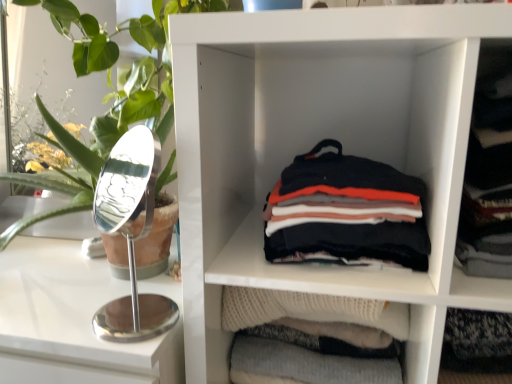
Question: Can you see green leafy plant at left touching soft cotton shirts at center?

Choices:
 (A) no
 (B) yes

Answer: (A)

Question: Is green leafy plant at left not within soft cotton shirts at center?

Choices:
 (A) no
 (B) yes

Answer: (B)

Question: Can you confirm if green leafy plant at left is shorter than soft cotton shirts at center?

Choices:
 (A) no
 (B) yes

Answer: (A)

Question: From a real-world perspective, is green leafy plant at left beneath soft cotton shirts at center?

Choices:
 (A) no
 (B) yes

Answer: (A)

Question: Considering the relative sizes of green leafy plant at left and soft cotton shirts at center in the image provided, is green leafy plant at left wider than soft cotton shirts at center?

Choices:
 (A) no
 (B) yes

Answer: (B)

Question: From a real-world perspective, does green leafy plant at left stand above soft cotton shirts at center?

Choices:
 (A) yes
 (B) no

Answer: (A)

Question: Can you confirm if dark gray sweater at right is taller than green leafy plant at left?

Choices:
 (A) no
 (B) yes

Answer: (A)

Question: Can you confirm if dark gray sweater at right is thinner than green leafy plant at left?

Choices:
 (A) yes
 (B) no

Answer: (A)

Question: From the image's perspective, is dark gray sweater at right located above green leafy plant at left?

Choices:
 (A) yes
 (B) no

Answer: (B)

Question: Is dark gray sweater at right aimed at green leafy plant at left?

Choices:
 (A) no
 (B) yes

Answer: (A)

Question: Is dark gray sweater at right oriented away from green leafy plant at left?

Choices:
 (A) yes
 (B) no

Answer: (B)

Question: Is dark gray sweater at right positioned beyond the bounds of green leafy plant at left?

Choices:
 (A) no
 (B) yes

Answer: (B)

Question: From the image's perspective, is white matte shelf at center on dark gray sweater at right?

Choices:
 (A) yes
 (B) no

Answer: (B)